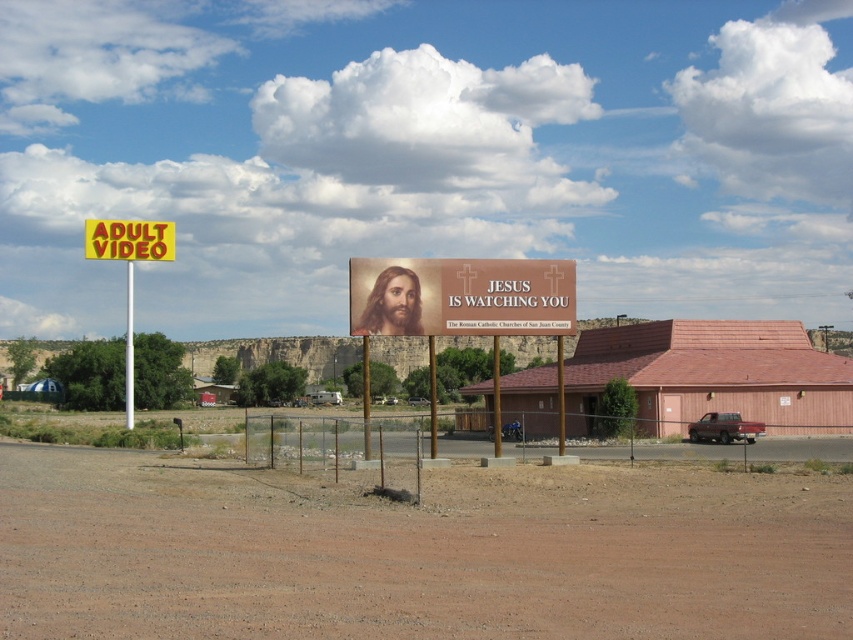
Who is lower down, brown sandy dirt at center or matte brown sign at center?

Positioned lower is brown sandy dirt at center.

Based on the photo, can you confirm if brown sandy dirt at center is wider than matte brown sign at center?

Yes.

Image resolution: width=853 pixels, height=640 pixels. What do you see at coordinates (410, 556) in the screenshot?
I see `brown sandy dirt at center` at bounding box center [410, 556].

Where is `brown sandy dirt at center`? This screenshot has width=853, height=640. brown sandy dirt at center is located at coordinates (410, 556).

Which of these two, brown sandy dirt at center or yellow plastic sign at left, stands taller?

With more height is yellow plastic sign at left.

Between brown sandy dirt at center and yellow plastic sign at left, which one is positioned lower?

brown sandy dirt at center is below.

Image resolution: width=853 pixels, height=640 pixels. What do you see at coordinates (410, 556) in the screenshot?
I see `brown sandy dirt at center` at bounding box center [410, 556].

Find the location of a particular element. The width and height of the screenshot is (853, 640). brown sandy dirt at center is located at coordinates click(410, 556).

Is point (186, 586) positioned before point (131, 400)?

Yes, it is.

The width and height of the screenshot is (853, 640). Describe the element at coordinates (410, 556) in the screenshot. I see `brown sandy dirt at center` at that location.

Between point (27, 595) and point (131, 317), which one is positioned behind?

The point (131, 317) is more distant.

The image size is (853, 640). Find the location of `brown sandy dirt at center`. brown sandy dirt at center is located at coordinates (410, 556).